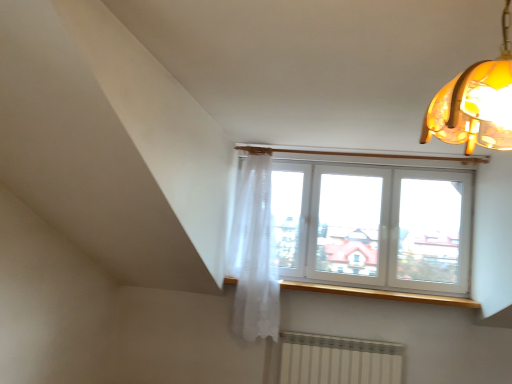
This screenshot has height=384, width=512. Describe the element at coordinates (254, 253) in the screenshot. I see `white sheer curtain at upper center` at that location.

Identify the location of translucent amber glass lampshade at upper right. This screenshot has height=384, width=512. (475, 103).

Between white sheer curtain at upper center and translucent amber glass lampshade at upper right, which one has larger size?

With larger size is white sheer curtain at upper center.

Is white sheer curtain at upper center oriented away from translucent amber glass lampshade at upper right?

No, white sheer curtain at upper center is not facing the opposite direction of translucent amber glass lampshade at upper right.

From a real-world perspective, does white sheer curtain at upper center stand above translucent amber glass lampshade at upper right?

No, from a real-world perspective, white sheer curtain at upper center is not above translucent amber glass lampshade at upper right.

Looking at this image, looking at their sizes, would you say white plastic window at upper center is wider or thinner than wooden at upper center?

white plastic window at upper center is thinner than wooden at upper center.

Can you confirm if white plastic window at upper center is smaller than wooden at upper center?

No, white plastic window at upper center is not smaller than wooden at upper center.

Does point (393, 288) appear closer or farther from the camera than point (415, 300)?

Clearly, point (393, 288) is more distant from the camera than point (415, 300).

Would you consider white plastic window at upper center to be distant from wooden at upper center?

white plastic window at upper center is actually quite close to wooden at upper center.

Is white plastic window at upper center shorter than translucent amber glass lampshade at upper right?

No, white plastic window at upper center is not shorter than translucent amber glass lampshade at upper right.

Looking at their sizes, would you say white plastic window at upper center is wider or thinner than translucent amber glass lampshade at upper right?

Considering their sizes, white plastic window at upper center looks slimmer than translucent amber glass lampshade at upper right.

Based on the photo, is white plastic window at upper center closer to the viewer compared to translucent amber glass lampshade at upper right?

No, it is behind translucent amber glass lampshade at upper right.

Can you confirm if white plastic window at upper center is bigger than translucent amber glass lampshade at upper right?

Yes, white plastic window at upper center is bigger than translucent amber glass lampshade at upper right.

Is white sheer curtain at upper center facing away from white plastic window at upper center?

That's not correct — white sheer curtain at upper center is not looking away from white plastic window at upper center.

Is white sheer curtain at upper center wider or thinner than white plastic window at upper center?

white sheer curtain at upper center is wider than white plastic window at upper center.

Can you confirm if white sheer curtain at upper center is smaller than white plastic window at upper center?

Yes, white sheer curtain at upper center is smaller than white plastic window at upper center.

Where is `curtain that is in front of the white plastic window at upper center`? Image resolution: width=512 pixels, height=384 pixels. curtain that is in front of the white plastic window at upper center is located at coordinates (254, 253).

Does wooden at upper center have a larger size compared to white plastic window at upper center?

No.

Would you say wooden at upper center is a long distance from white plastic window at upper center?

No, wooden at upper center is not far away from white plastic window at upper center.

What's the angular difference between wooden at upper center and white plastic window at upper center's facing directions?

0.000691 degrees separate the facing orientations of wooden at upper center and white plastic window at upper center.

The width and height of the screenshot is (512, 384). I want to click on window sill located underneath the white plastic window at upper center (from a real-world perspective), so click(x=381, y=294).

From the image's perspective, is wooden at upper center below white sheer curtain at upper center?

Yes, from the image's perspective, wooden at upper center is beneath white sheer curtain at upper center.

Is there a large distance between wooden at upper center and white sheer curtain at upper center?

No, wooden at upper center is in close proximity to white sheer curtain at upper center.

Considering the sizes of objects wooden at upper center and white sheer curtain at upper center in the image provided, who is taller, wooden at upper center or white sheer curtain at upper center?

white sheer curtain at upper center is taller.

From the picture: Is wooden at upper center oriented towards white sheer curtain at upper center?

No, wooden at upper center is not oriented towards white sheer curtain at upper center.

Does wooden at upper center turn towards translucent amber glass lampshade at upper right?

No.

Would you say wooden at upper center contains translucent amber glass lampshade at upper right?

No.

Considering the positions of objects wooden at upper center and translucent amber glass lampshade at upper right in the image provided, who is more to the left, wooden at upper center or translucent amber glass lampshade at upper right?

translucent amber glass lampshade at upper right.

From a real-world perspective, which is physically above, wooden at upper center or translucent amber glass lampshade at upper right?

From a 3D spatial view, translucent amber glass lampshade at upper right is above.

Locate an element on the screen. The image size is (512, 384). lamp that is above the white sheer curtain at upper center (from a real-world perspective) is located at coordinates point(475,103).

In the image, there is a white plastic window at upper center. In order to click on window sill below it (from a real-world perspective) in this screenshot , I will do `click(381, 294)`.

Considering their positions, is white plastic window at upper center positioned closer to translucent amber glass lampshade at upper right than wooden at upper center?

Among the two, white plastic window at upper center is located nearer to translucent amber glass lampshade at upper right.

Based on their spatial positions, is translucent amber glass lampshade at upper right or white sheer curtain at upper center closer to white plastic window at upper center?

Based on the image, white sheer curtain at upper center appears to be nearer to white plastic window at upper center.

Based on their spatial positions, is white sheer curtain at upper center or wooden at upper center further from translucent amber glass lampshade at upper right?

Among the two, wooden at upper center is located further to translucent amber glass lampshade at upper right.

Based on their spatial positions, is wooden at upper center or white sheer curtain at upper center closer to white plastic window at upper center?

The object closer to white plastic window at upper center is wooden at upper center.

Based on their spatial positions, is wooden at upper center or white plastic window at upper center further from translucent amber glass lampshade at upper right?

Based on the image, wooden at upper center appears to be further to translucent amber glass lampshade at upper right.

When comparing their distances from wooden at upper center, does white sheer curtain at upper center or white plastic window at upper center seem closer?

Based on the image, white plastic window at upper center appears to be nearer to wooden at upper center.

When comparing their distances from wooden at upper center, does white sheer curtain at upper center or translucent amber glass lampshade at upper right seem further?

translucent amber glass lampshade at upper right.

Estimate the real-world distances between objects in this image. Which object is closer to white sheer curtain at upper center, translucent amber glass lampshade at upper right or white plastic window at upper center?

white plastic window at upper center is positioned closer to the anchor white sheer curtain at upper center.

Find the location of a particular element. This screenshot has height=384, width=512. curtain positioned between translucent amber glass lampshade at upper right and white plastic window at upper center from near to far is located at coordinates (254, 253).

Locate an element on the screen. window sill between white sheer curtain at upper center and white plastic window at upper center from left to right is located at coordinates (381, 294).

Locate an element on the screen. curtain between translucent amber glass lampshade at upper right and wooden at upper center in the front-back direction is located at coordinates [254, 253].

You are a GUI agent. You are given a task and a screenshot of the screen. Output one action in this format:
    pyautogui.click(x=<x>, y=<y>)
    Task: Click on the window sill between translucent amber glass lampshade at upper right and white plastic window at upper center in the front-back direction
    Image resolution: width=512 pixels, height=384 pixels.
    Given the screenshot: What is the action you would take?
    pyautogui.click(x=381, y=294)